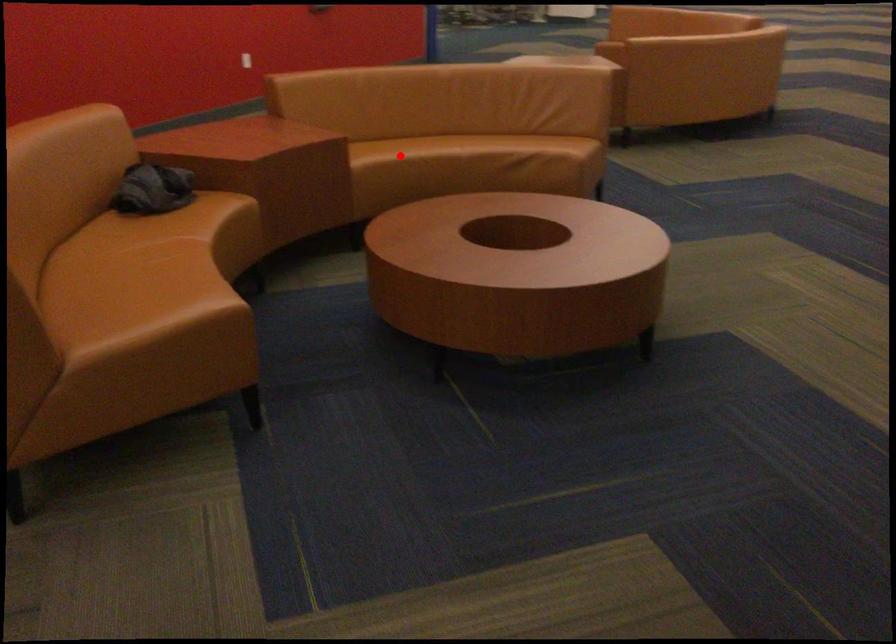
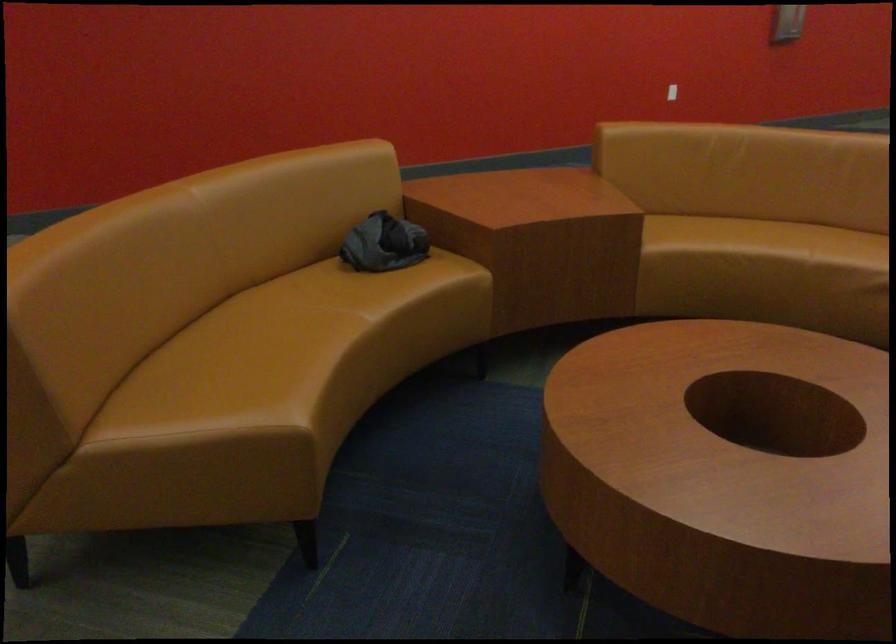
Question: I am providing you with two images of the same scene from different viewpoints. A red point is shown in image1. For the corresponding object point in image2, is it positioned nearer or farther from the camera?

Choices:
 (A) Nearer
 (B) Farther

Answer: (A)